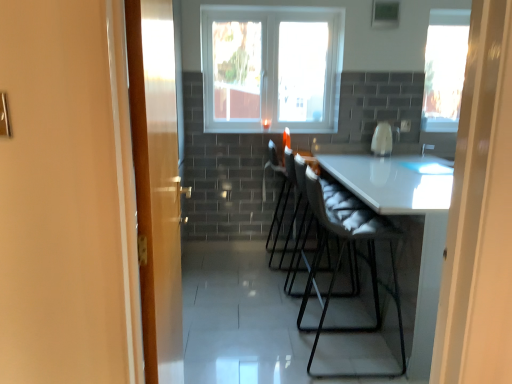
Find the location of `vacant space situated on the left part of white fabric folding chair at center`. vacant space situated on the left part of white fabric folding chair at center is located at coordinates (255, 281).